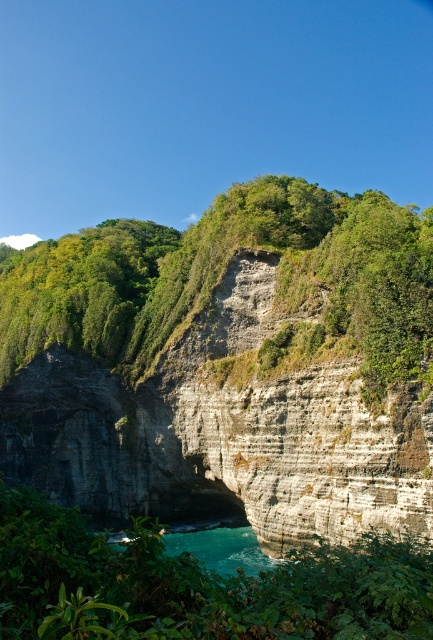
You are a hiker standing at the base of the cliff and notice the green leafy vegetation at lower center and the turquoise glossy water at lower center. Which of these two features is wider?

The green leafy vegetation at lower center is wider than the turquoise glossy water at lower center.

You are a hiker standing at the base of the cliff and see the green leafy vegetation at center and the green leafy vegetation at lower center. Which vegetation is closer to the cliff face?

The green leafy vegetation at center is closer to the cliff face because it is taller than the green leafy vegetation at lower center, which is shorter and positioned further away.